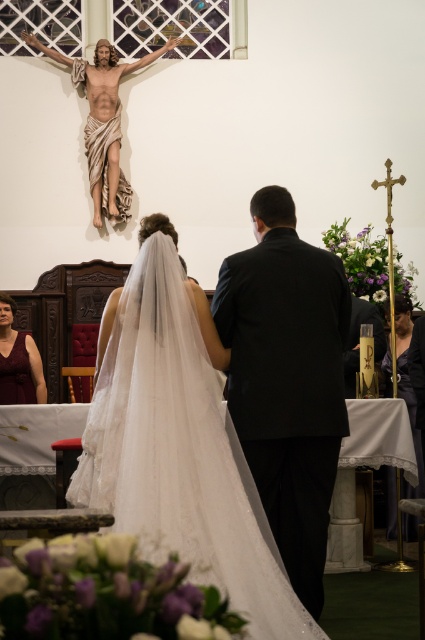
Is black satin suit at center above matte burgundy dress at lower left?

No, black satin suit at center is not above matte burgundy dress at lower left.

Between black satin suit at center and matte burgundy dress at lower left, which one is positioned higher?

matte burgundy dress at lower left is higher up.

Where is `black satin suit at center`? Image resolution: width=425 pixels, height=640 pixels. black satin suit at center is located at coordinates (286, 380).

At what (x,y) coordinates should I click in order to perform the action: click on black satin suit at center. Please return your answer as a coordinate pair (x, y). This screenshot has width=425, height=640. Looking at the image, I should click on (286, 380).

What do you see at coordinates (286, 380) in the screenshot?
I see `black satin suit at center` at bounding box center [286, 380].

Between point (305, 588) and point (152, 58), which one is positioned in front?

Point (305, 588) is more forward.

At what (x,y) coordinates should I click in order to perform the action: click on black satin suit at center. Please return your answer as a coordinate pair (x, y). This screenshot has width=425, height=640. Looking at the image, I should click on click(x=286, y=380).

Does white tulle veil at center have a greater width compared to black satin suit at center?

Indeed, white tulle veil at center has a greater width compared to black satin suit at center.

Between white tulle veil at center and black satin suit at center, which one appears on the left side from the viewer's perspective?

From the viewer's perspective, white tulle veil at center appears more on the left side.

Who is more distant from viewer, (192, 353) or (252, 200)?

The point (252, 200) is behind.

Find the location of a particular element. This screenshot has height=640, width=425. white tulle veil at center is located at coordinates (178, 442).